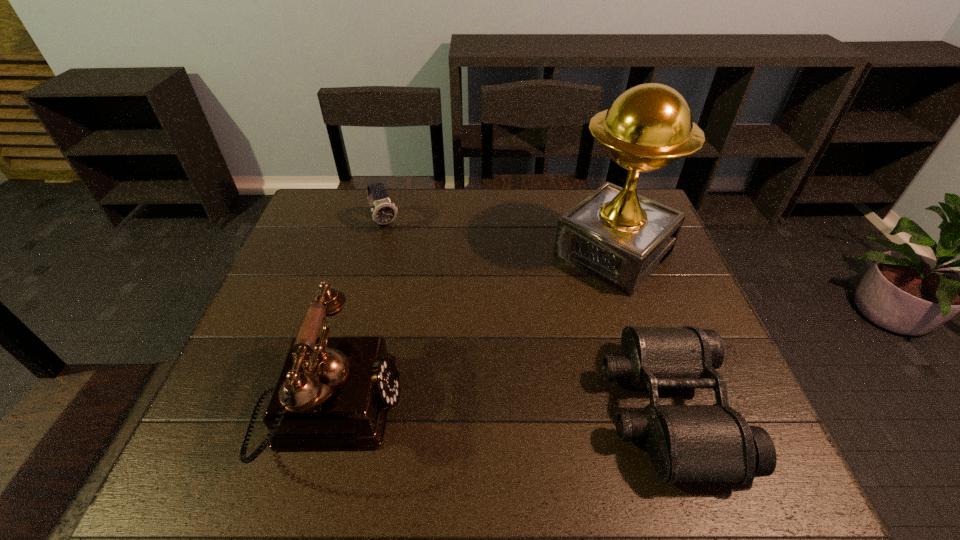
The height and width of the screenshot is (540, 960). Identify the location of unoccupied area between the second shortest object and the award. (499, 238).

Identify the location of vacant area that lies between the award and the watch. This screenshot has height=540, width=960. (499, 238).

Identify the location of free area in between the tallest object and the third tallest object. (499, 238).

Find the location of a particular element. This screenshot has height=540, width=960. free point between the telephone and the award is located at coordinates (471, 332).

Identify the location of free space between the tallest object and the telephone. (471, 332).

At what (x,y) coordinates should I click in order to perform the action: click on vacant space that is in between the shortest object and the second tallest object. Please return your answer as a coordinate pair (x, y). The height and width of the screenshot is (540, 960). Looking at the image, I should click on (498, 409).

The width and height of the screenshot is (960, 540). Identify the location of vacant area that lies between the shortest object and the third tallest object. (526, 316).

Locate an element on the screen. This screenshot has width=960, height=540. empty space between the award and the third shortest object is located at coordinates (471, 332).

I want to click on free spot between the second shortest object and the binoculars, so [526, 316].

Locate an element on the screen. Image resolution: width=960 pixels, height=540 pixels. the third closest object relative to the binoculars is located at coordinates (384, 211).